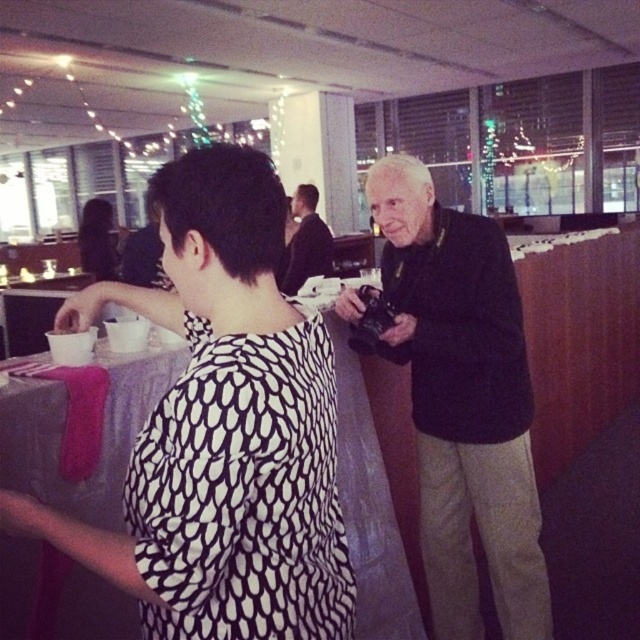
Between black printed shirt at center and black smooth suit at center, which one appears on the right side from the viewer's perspective?

black smooth suit at center

Does black printed shirt at center have a lesser width compared to black smooth suit at center?

No.

This screenshot has height=640, width=640. Describe the element at coordinates (221, 429) in the screenshot. I see `black printed shirt at center` at that location.

The height and width of the screenshot is (640, 640). I want to click on black printed shirt at center, so click(221, 429).

Does point (284, 250) come farther from viewer compared to point (90, 216)?

That is False.

Who is higher up, black smooth suit at center or matte black hair at upper left?

matte black hair at upper left

This screenshot has width=640, height=640. What do you see at coordinates (305, 243) in the screenshot? I see `black smooth suit at center` at bounding box center [305, 243].

The height and width of the screenshot is (640, 640). In order to click on black smooth suit at center in this screenshot , I will do `click(305, 243)`.

Is black printed shirt at center above matte black hair at upper left?

Actually, black printed shirt at center is below matte black hair at upper left.

Is black printed shirt at center bigger than matte black hair at upper left?

Incorrect, black printed shirt at center is not larger than matte black hair at upper left.

Describe the element at coordinates (221, 429) in the screenshot. I see `black printed shirt at center` at that location.

Identify the location of black printed shirt at center. The height and width of the screenshot is (640, 640). (221, 429).